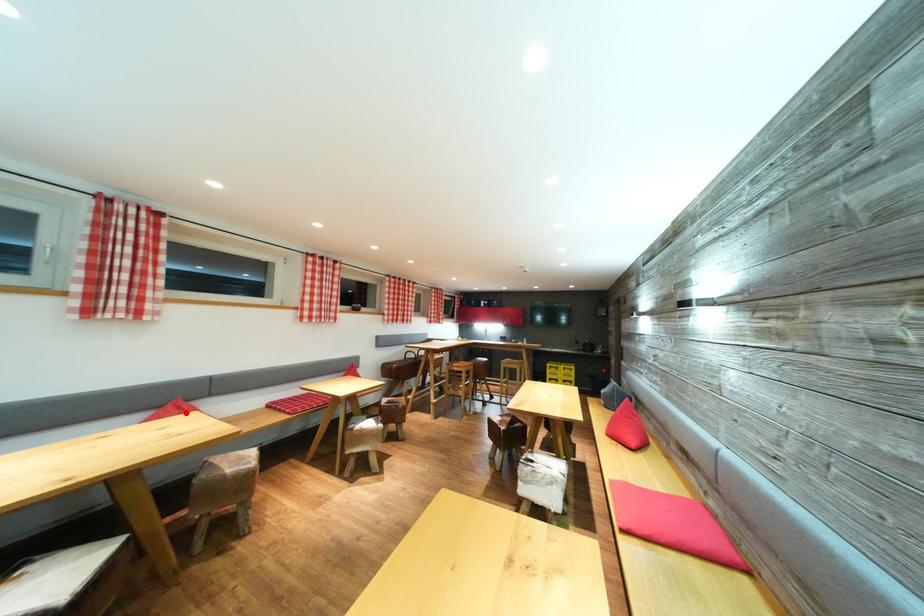
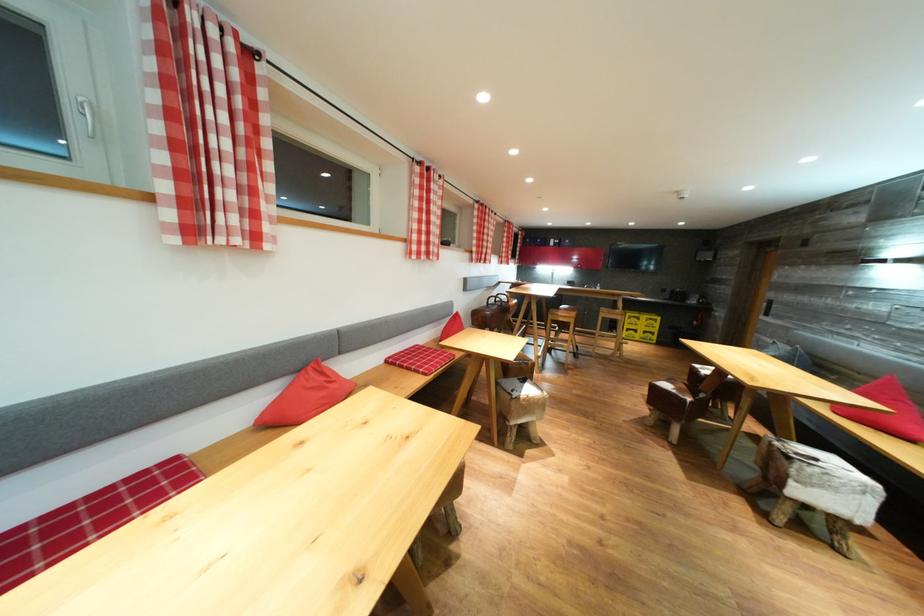
Question: I am providing you with two images of the same scene from different viewpoints. In image1, a red point is highlighted. Considering the same 3D point in image2, which of the following is correct?

Choices:
 (A) It is closer
 (B) It is farther

Answer: (A)